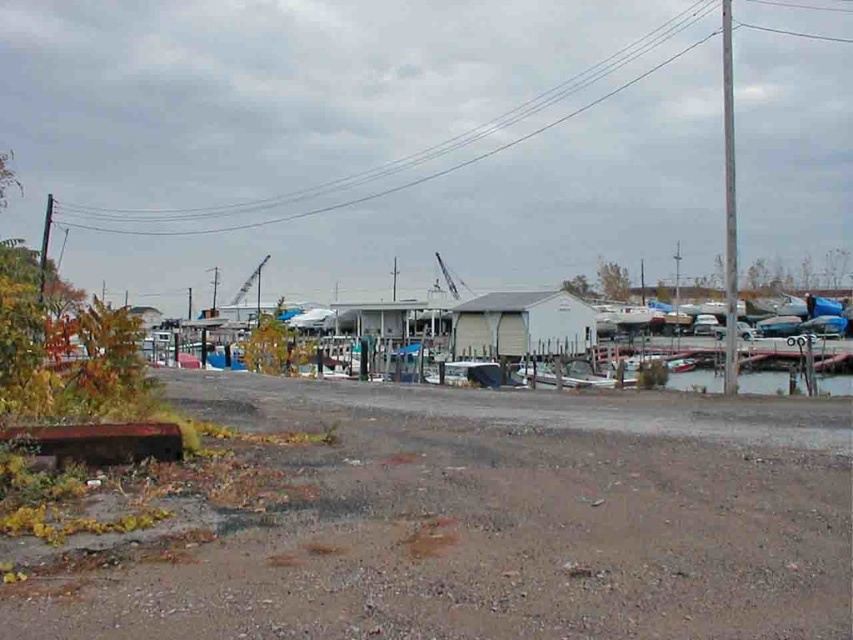
Looking at this image, you are navigating a small electric cart that must stay on the dull brown dirt track at lower left. You want to reach the clear water at lower right. Is the path between them wide enough for your cart to turn around?

The dull brown dirt track at lower left is to the left of clear water at lower right, so the path between them is not wide enough for the cart to turn around.

You are standing on the dirt path and want to cross to the other side of the white matte boat at center. Can you step onto the clear water at lower right to do so?

The clear water at lower right is larger in size than the white matte boat at center, so stepping onto the clear water at lower right might be possible if it can support your weight. However, water surfaces are typically not solid, so this may not be feasible unless there is a boat or platform available.